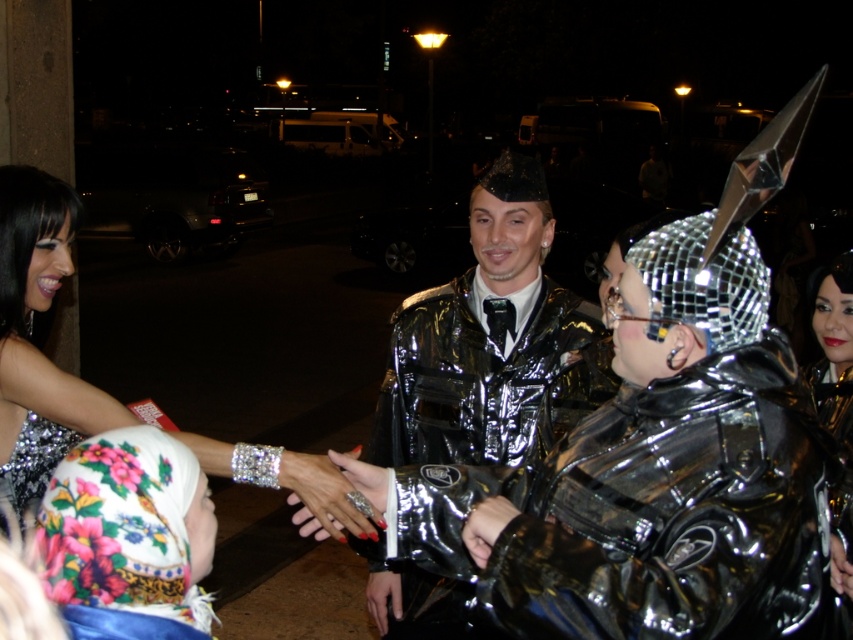
Question: Which object is farther from the camera taking this photo?

Choices:
 (A) shiny metallic helmet at center
 (B) shiny metallic jacket at center

Answer: (B)

Question: Considering the relative positions of silver sequined dress at left and shiny metallic helmet at center in the image provided, where is silver sequined dress at left located with respect to shiny metallic helmet at center?

Choices:
 (A) left
 (B) right

Answer: (A)

Question: Which of the following is the farthest from the observer?

Choices:
 (A) shiny metallic helmet at center
 (B) silver sequined dress at left
 (C) shiny metallic jacket at center

Answer: (C)

Question: Is shiny metallic jacket at center thinner than shiny metallic helmet at center?

Choices:
 (A) yes
 (B) no

Answer: (A)

Question: Is shiny metallic jacket at center positioned before silver sequined dress at left?

Choices:
 (A) no
 (B) yes

Answer: (A)

Question: Among these objects, which one is nearest to the camera?

Choices:
 (A) shiny metallic jacket at center
 (B) shiny metallic helmet at center

Answer: (B)